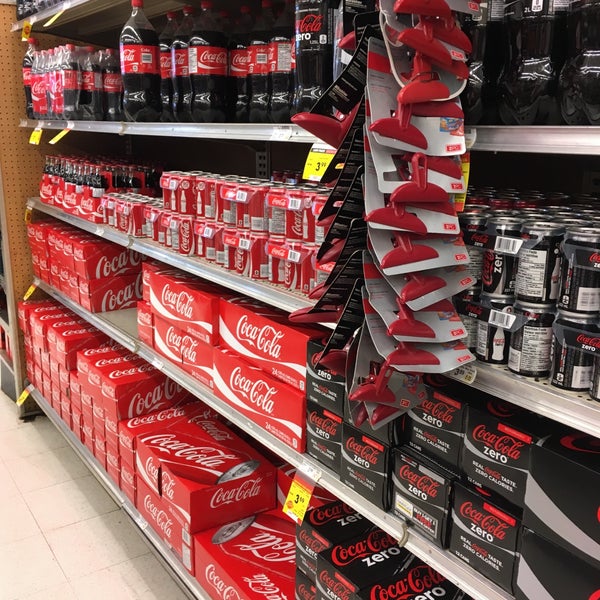
Where is `floor`? The image size is (600, 600). floor is located at coordinates [x=40, y=533].